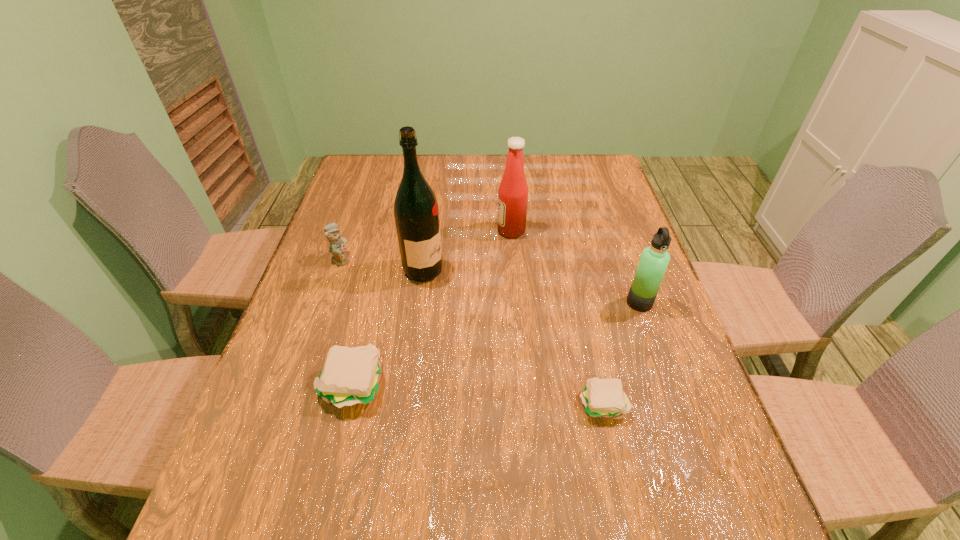
Locate an element on the screen. The width and height of the screenshot is (960, 540). vacant region that satisfies the following two spatial constraints: 1. on the front-facing side of the condiment; 2. on the right side of the right patty is located at coordinates (525, 403).

Find the location of a particular element. The image size is (960, 540). free space that satisfies the following two spatial constraints: 1. on the front-facing side of the fourth tallest object; 2. on the back side of the left patty is located at coordinates (299, 385).

At what (x,y) coordinates should I click in order to perform the action: click on free space that satisfies the following two spatial constraints: 1. on the front-facing side of the leftmost object; 2. on the right side of the shorter patty. Please return your answer as a coordinate pair (x, y). Image resolution: width=960 pixels, height=540 pixels. Looking at the image, I should click on (292, 403).

Locate an element on the screen. vacant space that satisfies the following two spatial constraints: 1. on the front-facing side of the third shortest object; 2. on the right side of the shorter patty is located at coordinates (292, 403).

In order to click on vacant space that satisfies the following two spatial constraints: 1. on the front-facing side of the third tallest object; 2. on the right side of the liquor in this screenshot , I will do `click(420, 302)`.

Locate an element on the screen. The height and width of the screenshot is (540, 960). free space that satisfies the following two spatial constraints: 1. on the front-facing side of the fifth shortest object; 2. on the left side of the shorter patty is located at coordinates (525, 403).